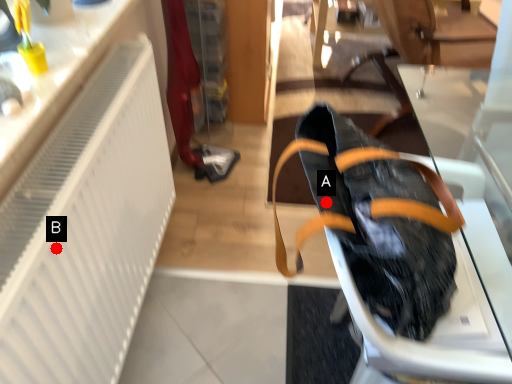
Question: Two points are circled on the image, labeled by A and B beside each circle. Which point is closer to the camera?

Choices:
 (A) A is closer
 (B) B is closer

Answer: (A)